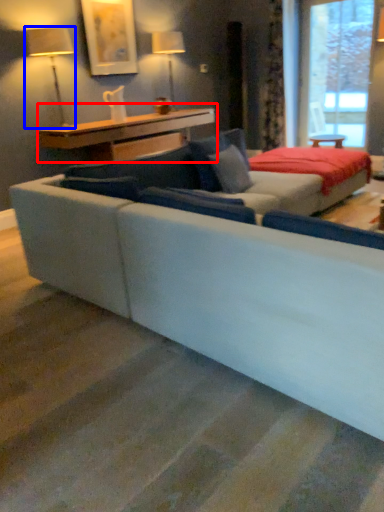
Question: Which of the following is the farthest to the observer, table (highlighted by a red box) or table lamp (highlighted by a blue box)?

Choices:
 (A) table
 (B) table lamp

Answer: (A)